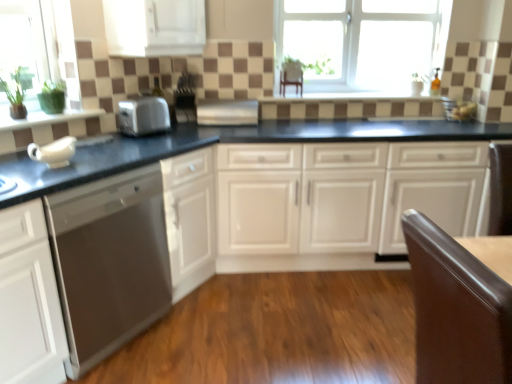
This screenshot has height=384, width=512. Describe the element at coordinates (154, 27) in the screenshot. I see `white glossy cabinet at upper center, the first cabinetry positioned from the left` at that location.

Where is `white glass window at upper center`? Image resolution: width=512 pixels, height=384 pixels. white glass window at upper center is located at coordinates (360, 40).

Locate an element on the screen. satin silver toaster at center, arranged as the 2th appliance when viewed from the right is located at coordinates (185, 95).

Image resolution: width=512 pixels, height=384 pixels. What do you see at coordinates (229, 142) in the screenshot?
I see `black granite countertop at center` at bounding box center [229, 142].

What do you see at coordinates (355, 203) in the screenshot? This screenshot has height=384, width=512. I see `white glossy cabinets at center, which is the second cabinetry in top-to-bottom order` at bounding box center [355, 203].

What is the approximate width of white glossy cabinets at center, the 2th cabinetry in the left-to-right sequence?

The width of white glossy cabinets at center, the 2th cabinetry in the left-to-right sequence, is 24.23 inches.

Identify the location of white glossy cabinet at upper center, the second cabinetry from the bottom. This screenshot has height=384, width=512. (154, 27).

Can you confirm if white glossy cabinets at center, the 2th cabinetry in the left-to-right sequence, is positioned to the left of satin stainless steel dishwasher at left?

No, white glossy cabinets at center, the 2th cabinetry in the left-to-right sequence, is not to the left of satin stainless steel dishwasher at left.

Is white glossy cabinets at center, which is the second cabinetry in top-to-bottom order, wider or thinner than satin stainless steel dishwasher at left?

In the image, white glossy cabinets at center, which is the second cabinetry in top-to-bottom order, appears to be more narrow than satin stainless steel dishwasher at left.

Is white glossy cabinets at center, the 2th cabinetry in the left-to-right sequence, shorter than satin stainless steel dishwasher at left?

Yes.

Is white glossy cabinets at center, the first cabinetry from the right, closer to camera compared to satin stainless steel dishwasher at left?

No, the depth of white glossy cabinets at center, the first cabinetry from the right, is greater than that of satin stainless steel dishwasher at left.

Would you consider glossy brown chair at lower right to be distant from satin silver toaster at center, arranged as the 2th appliance when viewed from the right?

Absolutely, glossy brown chair at lower right is distant from satin silver toaster at center, arranged as the 2th appliance when viewed from the right.

From the picture: Does glossy brown chair at lower right have a lesser width compared to satin silver toaster at center, arranged as the 2th appliance when viewed from the right?

Result: No.

Is satin silver toaster at center, placed as the 1th appliance when sorted from left to right, inside glossy brown chair at lower right?

No, satin silver toaster at center, placed as the 1th appliance when sorted from left to right, is located outside of glossy brown chair at lower right.

Which is closer, (188, 23) or (423, 182)?

The point (188, 23) is in front.

Considering the relative positions of white glossy cabinet at upper center, positioned as the first cabinetry in top-to-bottom order, and white glossy cabinets at center, the first cabinetry in the bottom-to-top sequence, in the image provided, is white glossy cabinet at upper center, positioned as the first cabinetry in top-to-bottom order, to the left of white glossy cabinets at center, the first cabinetry in the bottom-to-top sequence, from the viewer's perspective?

Correct, you'll find white glossy cabinet at upper center, positioned as the first cabinetry in top-to-bottom order, to the left of white glossy cabinets at center, the first cabinetry in the bottom-to-top sequence.

From the image's perspective, between white glossy cabinet at upper center, the first cabinetry positioned from the left, and white glossy cabinets at center, the first cabinetry from the right, who is located below?

white glossy cabinets at center, the first cabinetry from the right, appears lower in the image.

Is satin silver toaster at center, arranged as the 2th appliance when viewed from the right, not near satin silver toaster at center, which appears as the first appliance when viewed from the right?

They are positioned close to each other.

From a real-world perspective, which is physically below, satin silver toaster at center, placed as the 1th appliance when sorted from left to right, or satin silver toaster at center, which appears as the first appliance when viewed from the right?

In real-world perspective, satin silver toaster at center, which appears as the first appliance when viewed from the right, is lower.

In the scene shown: Does satin silver toaster at center, placed as the 1th appliance when sorted from left to right, have a larger size compared to satin silver toaster at center, marked as the 2th appliance in a left-to-right arrangement?

No, satin silver toaster at center, placed as the 1th appliance when sorted from left to right, is not bigger than satin silver toaster at center, marked as the 2th appliance in a left-to-right arrangement.

Are white glossy cabinets at center, the 2th cabinetry in the left-to-right sequence, and black granite countertop at center beside each other?

They are not placed beside each other.

Between white glossy cabinets at center, which is the second cabinetry in top-to-bottom order, and black granite countertop at center, which one has smaller width?

white glossy cabinets at center, which is the second cabinetry in top-to-bottom order, is thinner.

Which point is more distant from viewer, [185,98] or [404,58]?

The point [404,58] is farther from the camera.

From a real-world perspective, starting from the white glass window at upper center, which appliance is the 1st one below it? Please provide its 2D coordinates.

[(185, 95)]

From the image's perspective, is satin silver toaster at center, placed as the 1th appliance when sorted from left to right, positioned above or below white glass window at upper center?

satin silver toaster at center, placed as the 1th appliance when sorted from left to right, is below white glass window at upper center.

From the image's perspective, which is above, black granite countertop at center or satin silver toaster at center, placed as the 1th appliance when sorted from left to right?

satin silver toaster at center, placed as the 1th appliance when sorted from left to right, appears higher in the image.

Is black granite countertop at center oriented away from satin silver toaster at center, placed as the 1th appliance when sorted from left to right?

No, satin silver toaster at center, placed as the 1th appliance when sorted from left to right, is not at the back of black granite countertop at center.

Which point is more forward, [238,137] or [179,94]?

The point [238,137] is in front.

Consider the image. Is black granite countertop at center completely or partially outside of satin silver toaster at center, placed as the 1th appliance when sorted from left to right?

Yes, black granite countertop at center is located beyond the bounds of satin silver toaster at center, placed as the 1th appliance when sorted from left to right.

From the image's perspective, which cabinetry is the 1st one above the satin stainless steel dishwasher at left? Please provide its 2D coordinates.

[(355, 203)]

Find the location of a particular element. The height and width of the screenshot is (384, 512). the 2nd appliance positioned above the glossy brown chair at lower right (from a real-world perspective) is located at coordinates (x=185, y=95).

Looking at the image, which one is located closer to satin silver toaster at center, marked as the 2th appliance in a left-to-right arrangement, white glossy cabinets at center, which is the second cabinetry in top-to-bottom order, or satin stainless steel dishwasher at left?

Among the two, white glossy cabinets at center, which is the second cabinetry in top-to-bottom order, is located nearer to satin silver toaster at center, marked as the 2th appliance in a left-to-right arrangement.

Which object lies further to the anchor point white glossy cabinets at center, the first cabinetry from the right, satin silver toaster at center, arranged as the 2th appliance when viewed from the right, or satin stainless steel dishwasher at left?

satin silver toaster at center, arranged as the 2th appliance when viewed from the right, is further to white glossy cabinets at center, the first cabinetry from the right.

When comparing their distances from white glossy cabinets at center, the first cabinetry from the right, does white glass window at upper center or satin silver toaster at center, which appears as the first appliance when viewed from the right, seem closer?

satin silver toaster at center, which appears as the first appliance when viewed from the right, lies closer to white glossy cabinets at center, the first cabinetry from the right, than the other object.

Which object lies nearer to the anchor point black granite countertop at center, white glossy cabinets at center, the first cabinetry from the right, or glossy brown chair at lower right?

Based on the image, white glossy cabinets at center, the first cabinetry from the right, appears to be nearer to black granite countertop at center.

Based on their spatial positions, is white glossy cabinets at center, the first cabinetry from the right, or satin silver toaster at center closer to satin stainless steel dishwasher at left?

Based on the image, satin silver toaster at center appears to be nearer to satin stainless steel dishwasher at left.

Considering their positions, is white glass window at upper center positioned further to satin silver toaster at center than black granite countertop at center?

The object further to satin silver toaster at center is white glass window at upper center.

Which object lies further to the anchor point satin silver toaster at center, which appears as the first appliance when viewed from the right, white glass window at upper center or black granite countertop at center?

white glass window at upper center is further to satin silver toaster at center, which appears as the first appliance when viewed from the right.

Which object lies nearer to the anchor point white glass window at upper center, satin silver toaster at center, marked as the 2th appliance in a left-to-right arrangement, or white glossy cabinet at upper center, the first cabinetry positioned from the left?

The object closer to white glass window at upper center is satin silver toaster at center, marked as the 2th appliance in a left-to-right arrangement.

Locate an element on the screen. kitchen appliance between satin stainless steel dishwasher at left and satin silver toaster at center, placed as the 1th appliance when sorted from left to right, along the z-axis is located at coordinates (143, 116).

Locate an element on the screen. This screenshot has width=512, height=384. cabinetry between glossy brown chair at lower right and white glossy cabinets at center, which is the second cabinetry in top-to-bottom order, along the z-axis is located at coordinates (154, 27).

You are a GUI agent. You are given a task and a screenshot of the screen. Output one action in this format:
    pyautogui.click(x=<x>, y=<y>)
    Task: Click on the countertop between white glossy cabinet at upper center, the second cabinetry from the bottom, and white glass window at upper center, in the horizontal direction
    Image resolution: width=512 pixels, height=384 pixels.
    Given the screenshot: What is the action you would take?
    pyautogui.click(x=229, y=142)

Locate an element on the screen. This screenshot has width=512, height=384. appliance between satin silver toaster at center, arranged as the 2th appliance when viewed from the right, and white glossy cabinets at center, the first cabinetry in the bottom-to-top sequence is located at coordinates (227, 112).